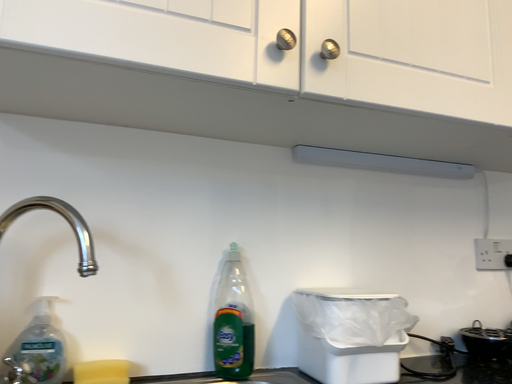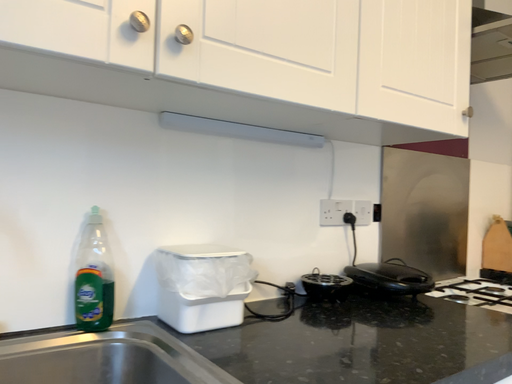
Question: Which way did the camera rotate in the video?

Choices:
 (A) rotated downward
 (B) rotated upward

Answer: (A)